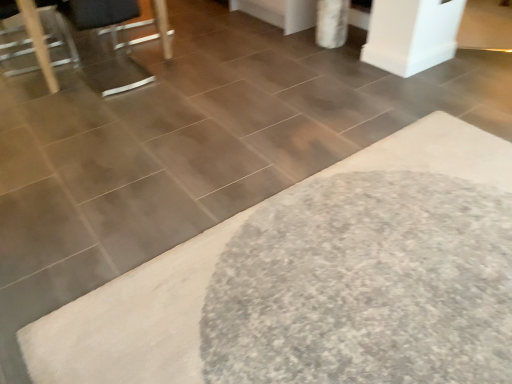
Question: Is metallic silver swivel chair at upper left a part of metallic silver chair at left?

Choices:
 (A) no
 (B) yes

Answer: (A)

Question: Is metallic silver chair at left turned away from metallic silver swivel chair at upper left?

Choices:
 (A) no
 (B) yes

Answer: (A)

Question: From a real-world perspective, is metallic silver chair at left positioned over metallic silver swivel chair at upper left based on gravity?

Choices:
 (A) yes
 (B) no

Answer: (B)

Question: Can you confirm if metallic silver chair at left is shorter than metallic silver swivel chair at upper left?

Choices:
 (A) yes
 (B) no

Answer: (A)

Question: Can you confirm if metallic silver chair at left is smaller than metallic silver swivel chair at upper left?

Choices:
 (A) yes
 (B) no

Answer: (A)

Question: From the image's perspective, is metallic silver chair at left on metallic silver swivel chair at upper left?

Choices:
 (A) no
 (B) yes

Answer: (B)

Question: Can you confirm if metallic silver swivel chair at upper left is shorter than metallic silver chair at left?

Choices:
 (A) no
 (B) yes

Answer: (A)

Question: Is metallic silver chair at left at the back of metallic silver swivel chair at upper left?

Choices:
 (A) yes
 (B) no

Answer: (B)

Question: Is metallic silver swivel chair at upper left thinner than metallic silver chair at left?

Choices:
 (A) yes
 (B) no

Answer: (B)

Question: Is metallic silver swivel chair at upper left far from metallic silver chair at left?

Choices:
 (A) no
 (B) yes

Answer: (A)

Question: Is metallic silver swivel chair at upper left positioned behind metallic silver chair at left?

Choices:
 (A) no
 (B) yes

Answer: (A)

Question: Is metallic silver swivel chair at upper left wider than metallic silver chair at left?

Choices:
 (A) no
 (B) yes

Answer: (B)

Question: From a real-world perspective, is white shaggy bath mat at lower right positioned over metallic silver chair at left based on gravity?

Choices:
 (A) no
 (B) yes

Answer: (A)